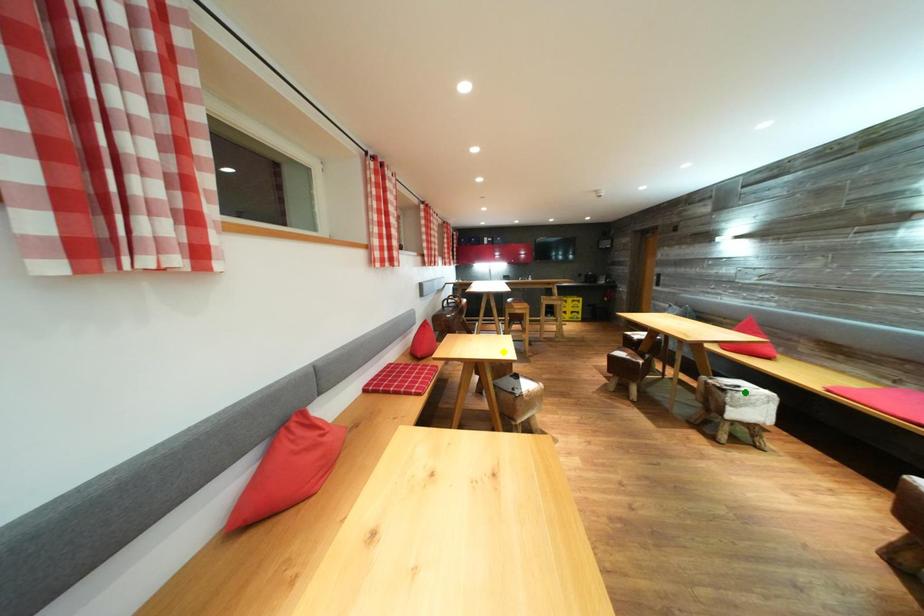
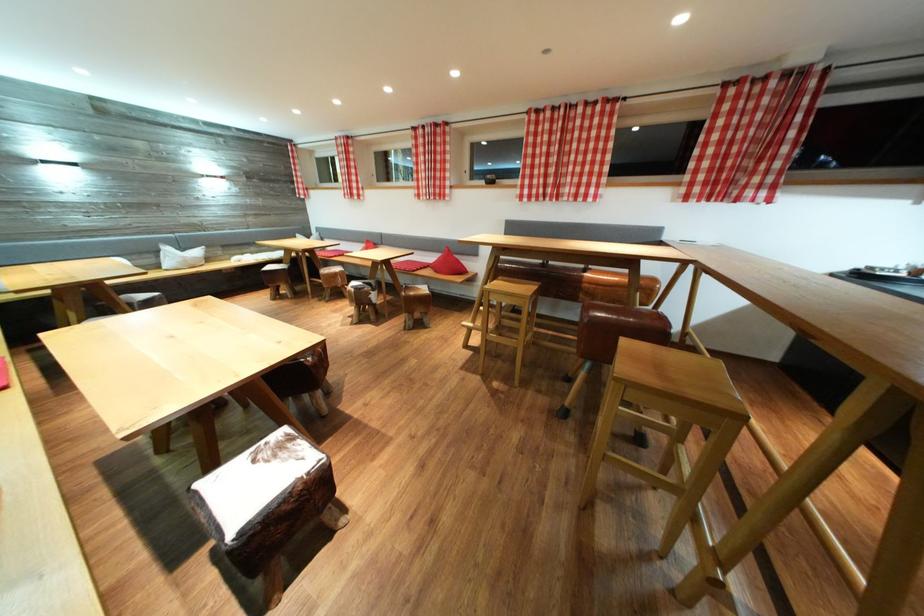
I am providing you with two images of the same scene from different viewpoints. Three points are marked in image1. Which point corresponds to a part or object that is occluded in image2?In image1, three points are marked. Which of them correspond to a part or object that is occluded in image2?Among the three points shown in image1, which one corresponds to a part or object that is no longer visible due to occlusion in image2?

yellow point, blue point, green point